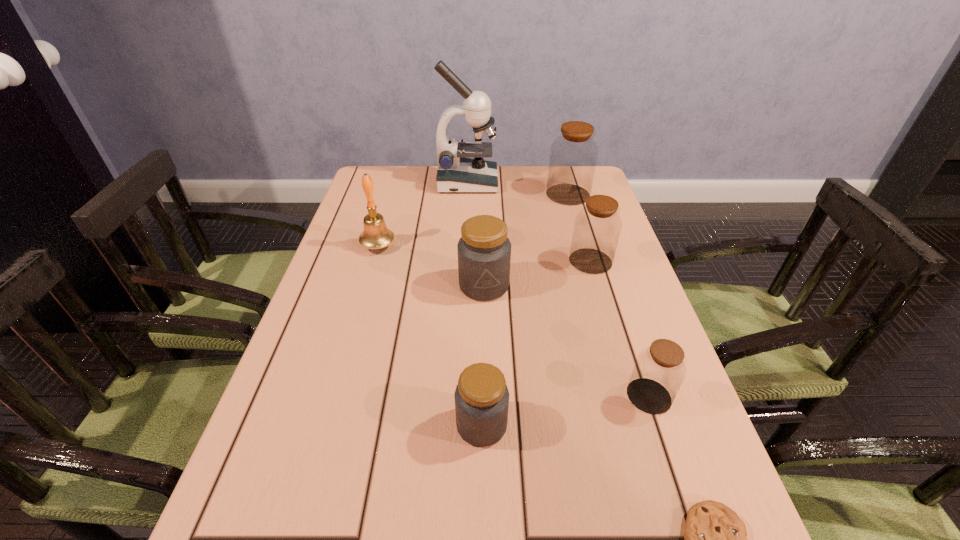
Identify the location of microscope. This screenshot has height=540, width=960. (456, 174).

This screenshot has height=540, width=960. Find the location of `the tallest object`. the tallest object is located at coordinates (456, 174).

Where is `the farthest jar`? This screenshot has width=960, height=540. the farthest jar is located at coordinates (573, 156).

Identify the location of the farthest brown jar. (573, 156).

Identify the location of the leftmost object. (375, 235).

The height and width of the screenshot is (540, 960). Identify the location of the second nearest brown jar. (597, 227).

Locate an element on the screen. The image size is (960, 540). the farther gray jar is located at coordinates (484, 251).

At what (x,y) coordinates should I click in order to perform the action: click on the nearer gray jar. Please return your answer as a coordinate pair (x, y). Looking at the image, I should click on (481, 397).

At what (x,y) coordinates should I click in order to perform the action: click on the nearest brown jar. Please return your answer as a coordinate pair (x, y). Looking at the image, I should click on pos(659,371).

Where is `vacant space situated on the right of the tallest object`? This screenshot has width=960, height=540. vacant space situated on the right of the tallest object is located at coordinates (560, 183).